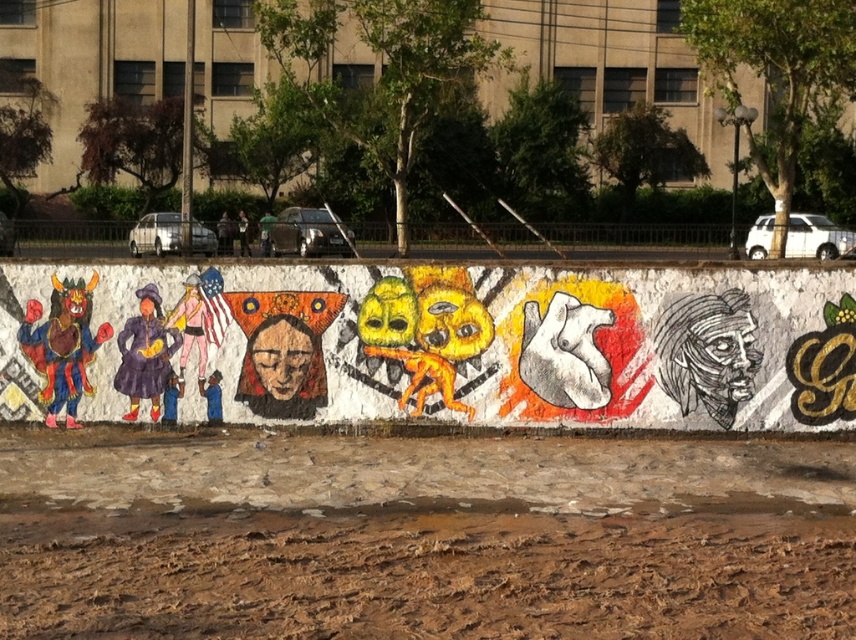
Is brown textured dirt at lower center shorter than vibrant painted mural at center?

Correct, brown textured dirt at lower center is not as tall as vibrant painted mural at center.

Is point (293, 492) behind point (488, 380)?

No, it is not.

At what (x,y) coordinates should I click in order to perform the action: click on brown textured dirt at lower center. Please return your answer as a coordinate pair (x, y). The image size is (856, 640). Looking at the image, I should click on (421, 536).